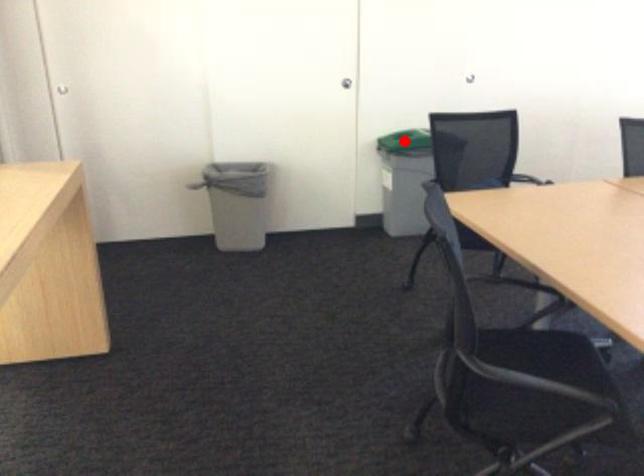
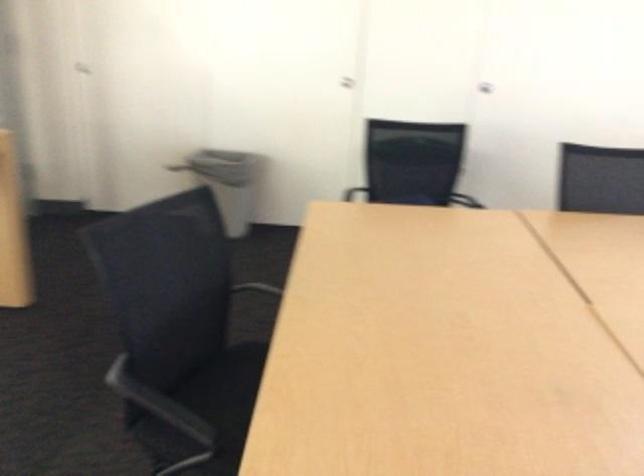
Question: I am providing you with two images of the same scene from different viewpoints. A red point is marked on the first image. Is the red point's position out of view in image 2?

Choices:
 (A) Yes
 (B) No

Answer: (A)